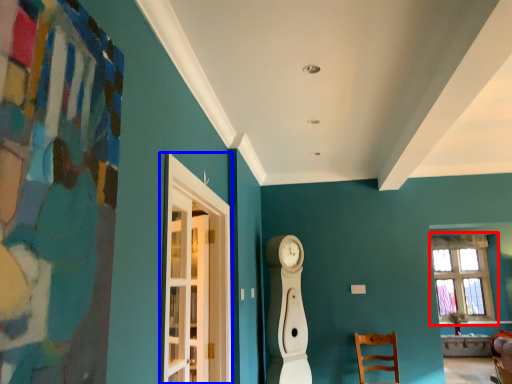
Question: Among these objects, which one is nearest to the camera, window (highlighted by a red box) or glass door (highlighted by a blue box)?

Choices:
 (A) window
 (B) glass door

Answer: (B)